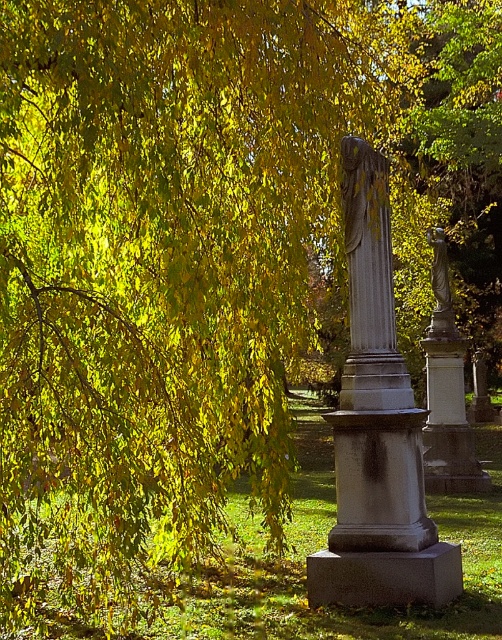
Does gray stone statue at center have a greater height compared to bronze statue at right?

Indeed, gray stone statue at center has a greater height compared to bronze statue at right.

Which is behind, point (366, 176) or point (447, 308)?

Positioned behind is point (447, 308).

Is point (379, 340) closer to viewer compared to point (442, 296)?

Yes, point (379, 340) is in front of point (442, 296).

In order to click on gray stone statue at center in this screenshot , I will do `click(369, 285)`.